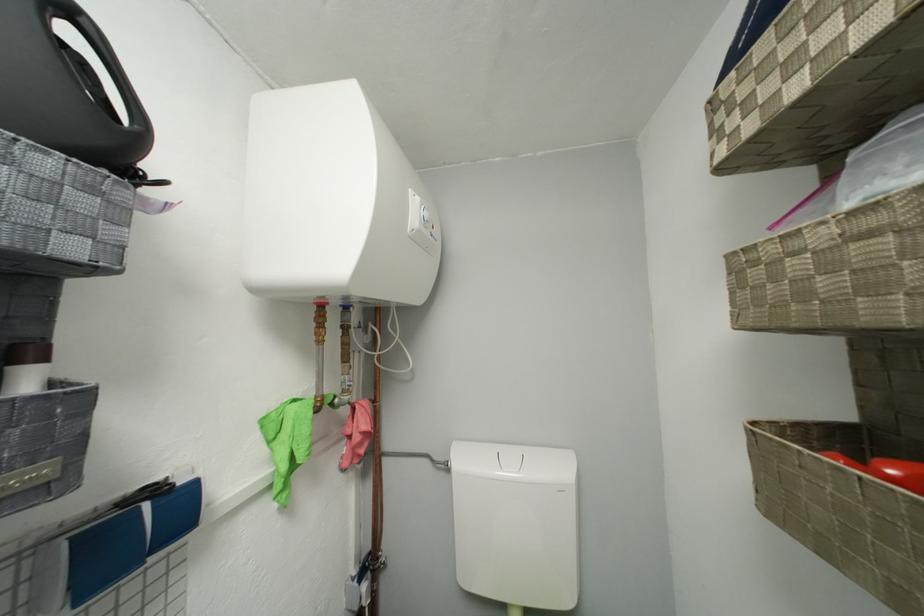
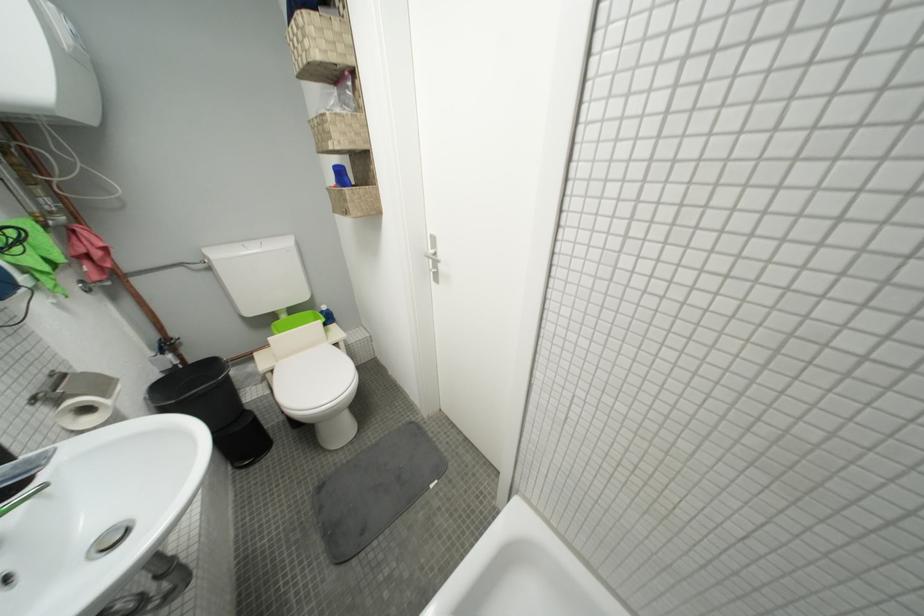
Where in the second image is the point corresponding to point (381, 567) from the first image?

(175, 347)